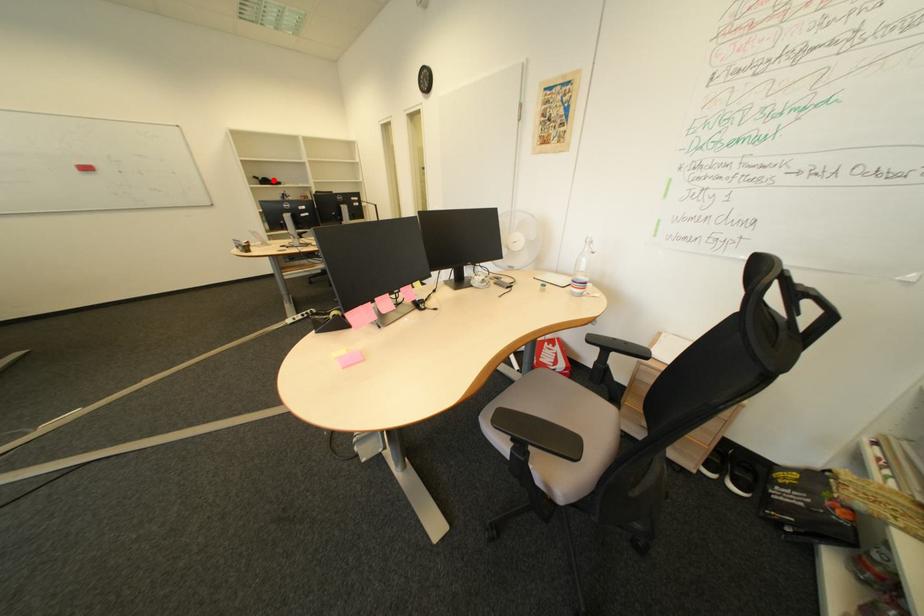
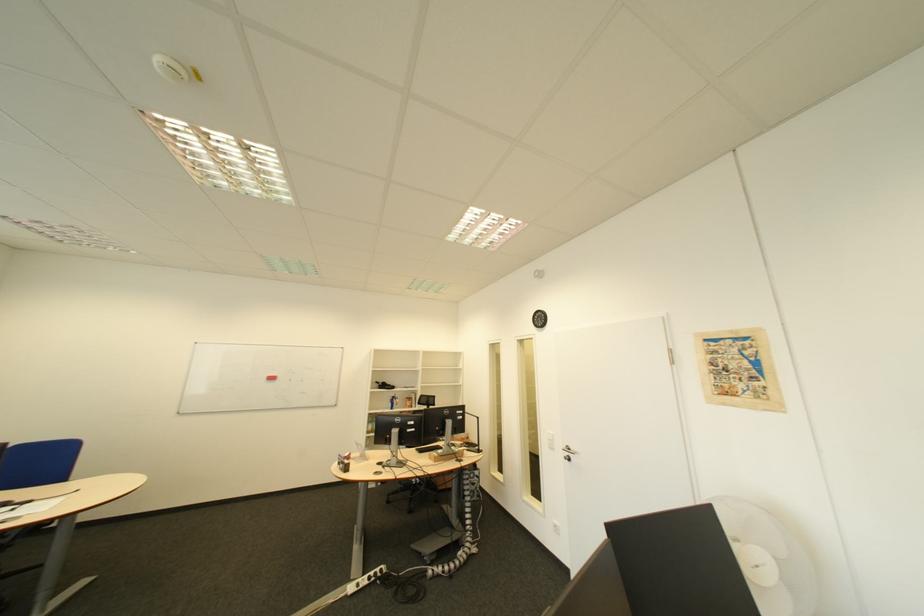
Question: I am providing you with two images of the same scene from different viewpoints. Given a red point in image1, look at the same physical point in image2. Is it:

Choices:
 (A) Closer to the viewpoint
 (B) Farther from the viewpoint

Answer: (B)